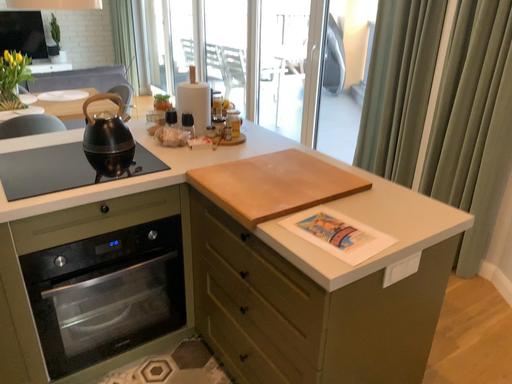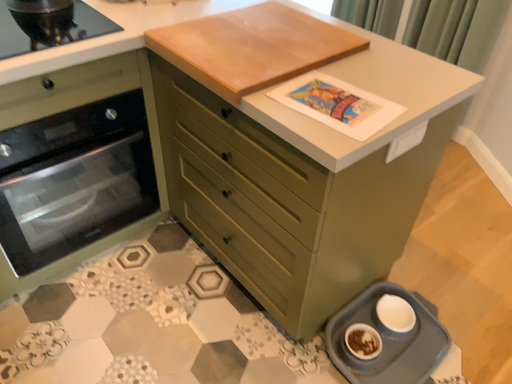
Question: How did the camera likely rotate when shooting the video?

Choices:
 (A) rotated downward
 (B) rotated upward

Answer: (A)